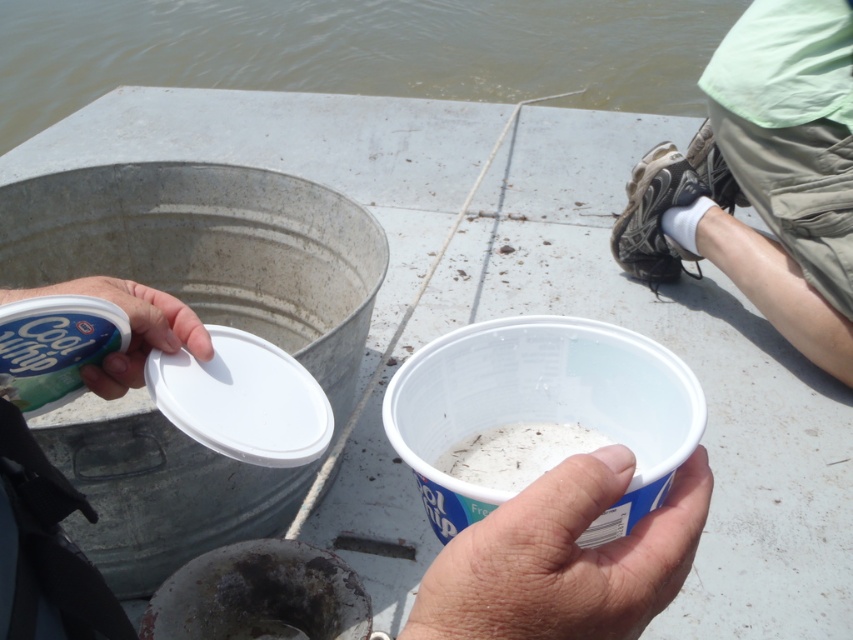
Question: Does green fabric shorts at lower right have a smaller size compared to white matte plastic cup at lower center?

Choices:
 (A) yes
 (B) no

Answer: (B)

Question: Is brown water at upper center positioned behind white matte plastic cup at center?

Choices:
 (A) no
 (B) yes

Answer: (B)

Question: Which point appears farthest from the camera in this image?

Choices:
 (A) (126, 369)
 (B) (428, 26)

Answer: (B)

Question: Which object is the closest to the white matte plastic cup at lower center?

Choices:
 (A) white matte plastic cup at center
 (B) white plastic lid at center
 (C) brown water at upper center
 (D) green fabric shorts at lower right

Answer: (A)

Question: In this image, where is brown water at upper center located relative to white matte plastic cup at lower center?

Choices:
 (A) below
 (B) above

Answer: (B)

Question: Among these objects, which one is farthest from the camera?

Choices:
 (A) brown water at upper center
 (B) white plastic lid at center
 (C) white matte plastic cup at lower center
 (D) white matte plastic cup at center

Answer: (A)